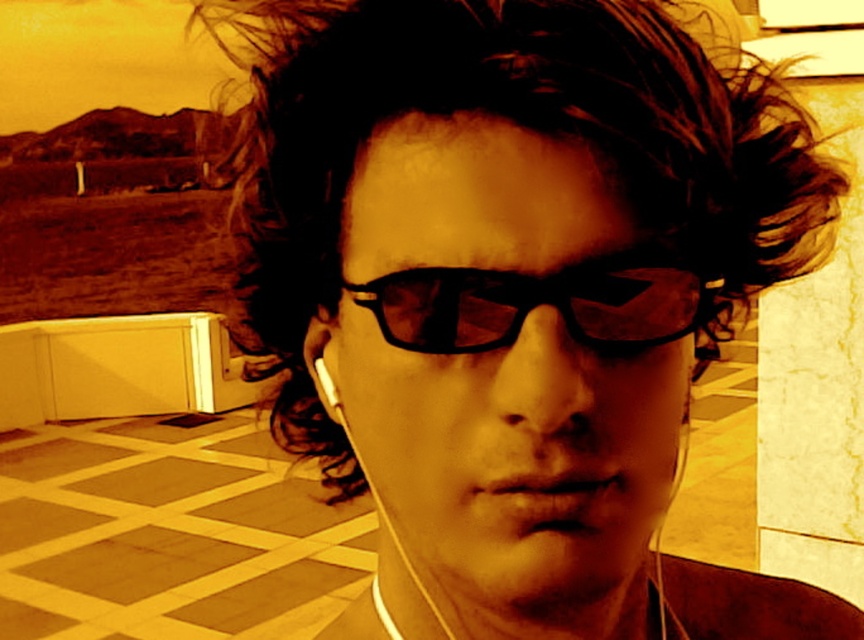
You are a GUI agent. You are given a task and a screenshot of the screen. Output one action in this format:
    pyautogui.click(x=<x>, y=<y>)
    Task: Click on the dark brown curly hair at center
    This screenshot has width=864, height=640.
    Given the screenshot: What is the action you would take?
    pyautogui.click(x=521, y=124)

Is dark brown curly hair at center to the left of black matte earphone at center from the viewer's perspective?

No, dark brown curly hair at center is not to the left of black matte earphone at center.

Find the location of a particular element. dark brown curly hair at center is located at coordinates pyautogui.click(x=521, y=124).

Is dark brown curly hair at center taller than black matte glasses at center?

Yes, dark brown curly hair at center is taller than black matte glasses at center.

Who is shorter, dark brown curly hair at center or black matte glasses at center?

black matte glasses at center

What do you see at coordinates (521, 124) in the screenshot? I see `dark brown curly hair at center` at bounding box center [521, 124].

Identify the location of dark brown curly hair at center. This screenshot has height=640, width=864. (521, 124).

Does black matte glasses at center appear on the left side of black matte earphone at center?

In fact, black matte glasses at center is to the right of black matte earphone at center.

Is black matte glasses at center shorter than black matte earphone at center?

No, black matte glasses at center is not shorter than black matte earphone at center.

Which is behind, point (410, 332) or point (324, 365)?

The point (324, 365) is more distant.

Where is `black matte glasses at center`? black matte glasses at center is located at coordinates (543, 304).